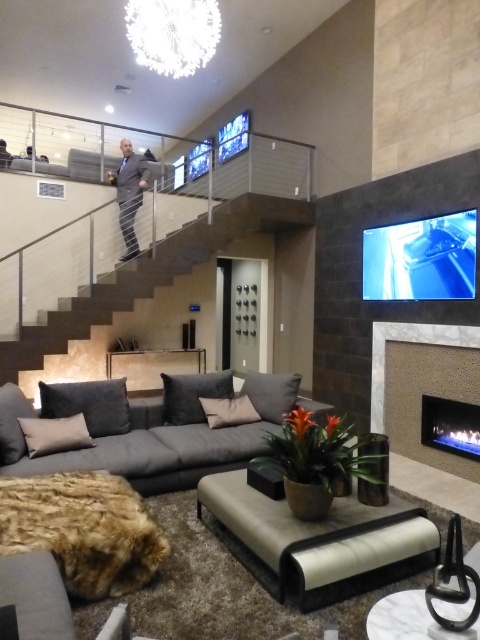
Question: Does dark gray fabric couch at center come in front of dark gray stone stairs at center?

Choices:
 (A) no
 (B) yes

Answer: (B)

Question: Among these points, which one is nearest to the camera?

Choices:
 (A) (140, 289)
 (B) (415, 358)
 (C) (130, 188)
 (D) (320, 406)

Answer: (D)

Question: Estimate the real-world distances between objects in this image. Which object is farther from the dark gray fabric couch at center?

Choices:
 (A) matte gray ottoman at center
 (B) matte beige fireplace at lower right

Answer: (B)

Question: Does matte gray ottoman at center have a lesser width compared to dark gray stone stairs at center?

Choices:
 (A) no
 (B) yes

Answer: (B)

Question: Which of these objects is positioned farthest from the matte beige fireplace at lower right?

Choices:
 (A) dark gray suit at upper center
 (B) dark gray fabric couch at center

Answer: (A)

Question: Is dark gray fabric couch at center to the left of dark gray stone stairs at center from the viewer's perspective?

Choices:
 (A) yes
 (B) no

Answer: (B)